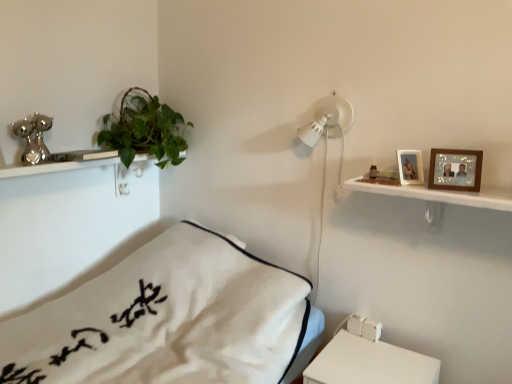
Question: From a real-world perspective, is wooden photo frame at upper right, marked as the 2th picture frame in a right-to-left arrangement, above or below white matte table at lower right?

Choices:
 (A) above
 (B) below

Answer: (A)

Question: Would you say wooden photo frame at upper right, the first picture frame in the back-to-front sequence, is to the left or to the right of white matte table at lower right in the picture?

Choices:
 (A) left
 (B) right

Answer: (B)

Question: Estimate the real-world distances between objects in this image. Which object is closer to the wooden photo frame at upper right, positioned as the second picture frame in front-to-back order?

Choices:
 (A) wooden picture frame at upper right, the 1th picture frame viewed from the front
 (B) green leafy plant at upper left
 (C) white cotton bed at center
 (D) white matte table at lower right

Answer: (A)

Question: Based on their relative distances, which object is nearer to the green leafy plant at upper left?

Choices:
 (A) wooden picture frame at upper right, acting as the 2th picture frame starting from the left
 (B) white cotton bed at center
 (C) wooden photo frame at upper right, positioned as the second picture frame in front-to-back order
 (D) white matte table at lower right

Answer: (B)